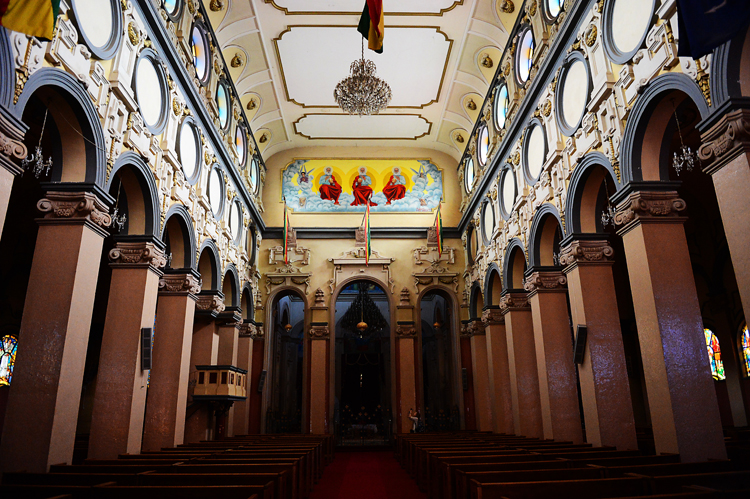
The width and height of the screenshot is (750, 499). I want to click on lights, so click(x=361, y=326), click(x=289, y=326), click(x=433, y=323).